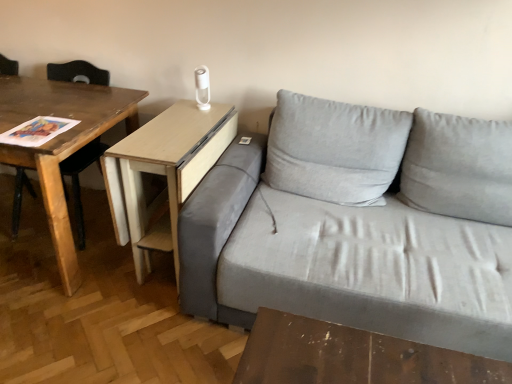
Question: Is wooden table at left, which is the 1th table in left-to-right order, to the left of gray fabric couch at center from the viewer's perspective?

Choices:
 (A) no
 (B) yes

Answer: (B)

Question: Would you say wooden table at left, arranged as the 2th table when viewed from the right, contains gray fabric couch at center?

Choices:
 (A) yes
 (B) no

Answer: (B)

Question: From a real-world perspective, is wooden table at left, which is the 1th table in left-to-right order, beneath gray fabric couch at center?

Choices:
 (A) no
 (B) yes

Answer: (B)

Question: From the image's perspective, is wooden table at left, arranged as the 2th table when viewed from the right, beneath gray fabric couch at center?

Choices:
 (A) yes
 (B) no

Answer: (B)

Question: Considering the relative sizes of wooden table at left, which is the 1th table in left-to-right order, and gray fabric couch at center in the image provided, is wooden table at left, which is the 1th table in left-to-right order, wider than gray fabric couch at center?

Choices:
 (A) yes
 (B) no

Answer: (B)

Question: In the image, is wooden table at left, arranged as the 2th table when viewed from the right, on the left side or the right side of gray fabric couch at center?

Choices:
 (A) right
 (B) left

Answer: (B)

Question: From a real-world perspective, is wooden table at left, which is the 1th table in left-to-right order, physically located above or below gray fabric couch at center?

Choices:
 (A) above
 (B) below

Answer: (B)

Question: Which is correct: wooden table at left, which is the 1th table in left-to-right order, is inside gray fabric couch at center, or outside of it?

Choices:
 (A) inside
 (B) outside

Answer: (B)

Question: Considering their positions, is wooden table at left, which is the 1th table in left-to-right order, located in front of or behind gray fabric couch at center?

Choices:
 (A) front
 (B) behind

Answer: (B)

Question: Does point (338, 148) appear closer or farther from the camera than point (5, 97)?

Choices:
 (A) closer
 (B) farther

Answer: (A)

Question: From a real-world perspective, is gray fabric couch at center physically located above or below wooden table at left, arranged as the 2th table when viewed from the right?

Choices:
 (A) below
 (B) above

Answer: (B)

Question: Looking at their shapes, would you say gray fabric couch at center is wider or thinner than wooden table at left, arranged as the 2th table when viewed from the right?

Choices:
 (A) thin
 (B) wide

Answer: (B)

Question: Considering the relative positions of gray fabric couch at center and wooden table at left, which is the 1th table in left-to-right order, in the image provided, is gray fabric couch at center to the left or to the right of wooden table at left, which is the 1th table in left-to-right order,?

Choices:
 (A) right
 (B) left

Answer: (A)

Question: From the image's perspective, is light wood/woodenobject at center, which ranks as the first table in right-to-left order, located above or below gray fabric couch at center?

Choices:
 (A) above
 (B) below

Answer: (A)

Question: From a real-world perspective, is light wood/woodenobject at center, which appears as the second table when viewed from the left, positioned above or below gray fabric couch at center?

Choices:
 (A) above
 (B) below

Answer: (B)